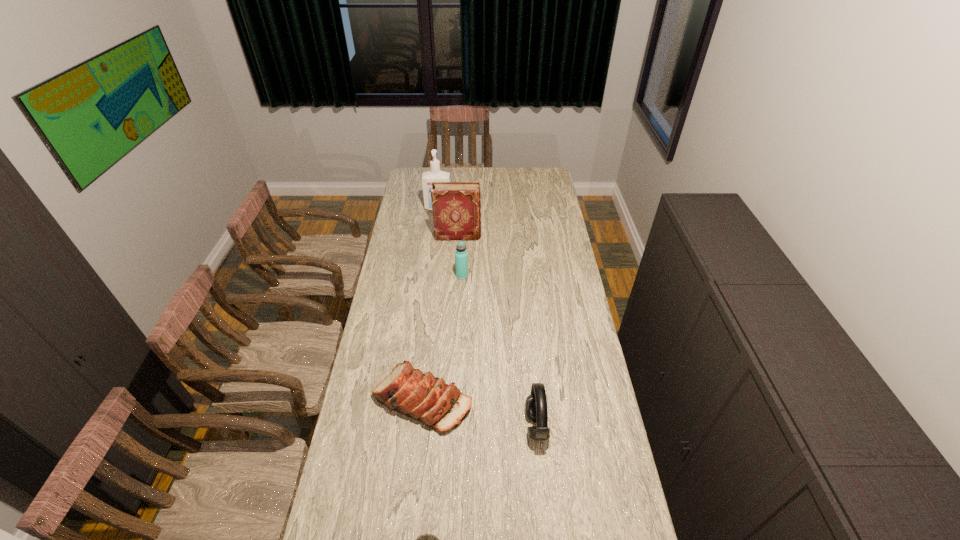
Where is `vacant space located on the earcups of the headset`? vacant space located on the earcups of the headset is located at coordinates (462, 427).

You are a GUI agent. You are given a task and a screenshot of the screen. Output one action in this format:
    pyautogui.click(x=<x>, y=<y>)
    Task: Click on the vacant space located 0.070m on the earcups of the headset
    
    Given the screenshot: What is the action you would take?
    pyautogui.click(x=505, y=427)

I want to click on vacant space located 0.230m on the right of the bread, so click(x=537, y=400).

Where is `cleansing agent located at the left edge`? cleansing agent located at the left edge is located at coordinates (435, 175).

This screenshot has height=540, width=960. Identify the location of bread at the left edge. (428, 399).

The image size is (960, 540). In the image, there is a desktop. What are the coordinates of `vacant space at the left edge` in the screenshot? It's located at (415, 217).

Locate an element on the screen. The width and height of the screenshot is (960, 540). vacant space at the right edge of the desktop is located at coordinates click(541, 221).

In the image, there is a desktop. What are the coordinates of `vacant space at the far right corner` in the screenshot? It's located at (530, 188).

At what (x,y) coordinates should I click in order to perform the action: click on vacant area that lies between the rightmost object and the farthest object. Please return your answer as a coordinate pair (x, y). This screenshot has height=540, width=960. Looking at the image, I should click on (487, 318).

At what (x,y) coordinates should I click in order to perform the action: click on free spot between the cleansing agent and the bread. Please return your answer as a coordinate pair (x, y). Looking at the image, I should click on (430, 304).